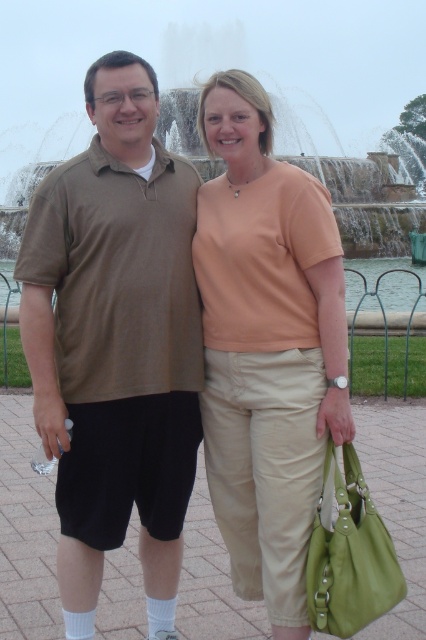
You are standing in front of the fountain and want to take a photo of the beige cotton shirt at center and the frosted glass water at center. Which object is positioned closer to the camera?

The beige cotton shirt at center is closer to the viewer than the frosted glass water at center, so it will appear closer to the camera in the photo.